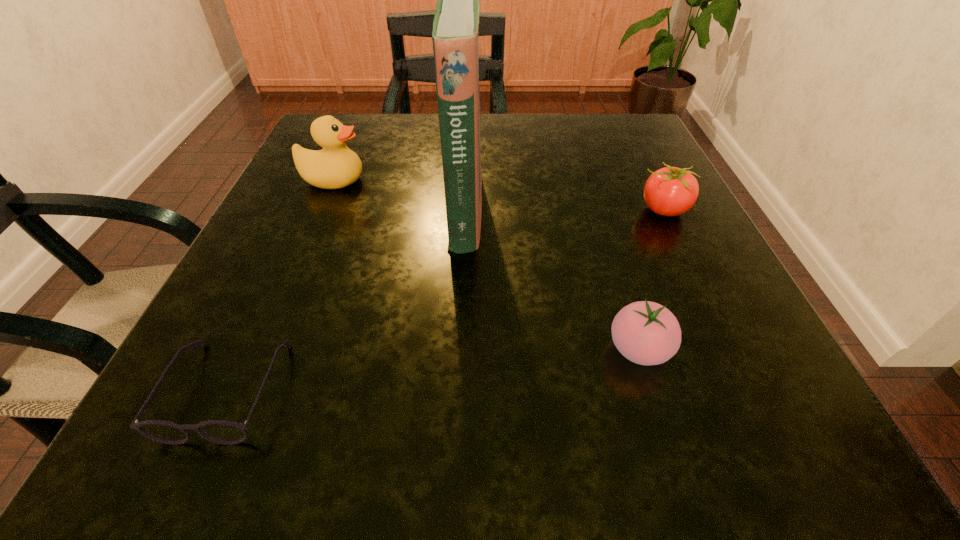
Locate an element on the screen. the third object from right to left is located at coordinates (455, 35).

At what (x,y) coordinates should I click in order to perform the action: click on the tallest object. Please return your answer as a coordinate pair (x, y). The image size is (960, 540). Looking at the image, I should click on (455, 35).

Identify the location of duck. (336, 166).

At what (x,y) coordinates should I click in order to perform the action: click on the rightmost object. Please return your answer as a coordinate pair (x, y). Looking at the image, I should click on (670, 191).

Where is `the farther tomato`? Image resolution: width=960 pixels, height=540 pixels. the farther tomato is located at coordinates (670, 191).

You are a GUI agent. You are given a task and a screenshot of the screen. Output one action in this format:
    pyautogui.click(x=<x>, y=<y>)
    Task: Click on the left tomato
    
    Given the screenshot: What is the action you would take?
    [646, 333]

Locate an element on the screen. the fourth object from left to right is located at coordinates (646, 333).

Find the location of `spectacles`. spectacles is located at coordinates (218, 431).

Locate an element on the screen. Image resolution: width=960 pixels, height=540 pixels. free point located 0.060m on the cover of the tallest object is located at coordinates click(x=516, y=210).

Find the location of a particular element. vacant area located at the beak of the duck is located at coordinates (396, 180).